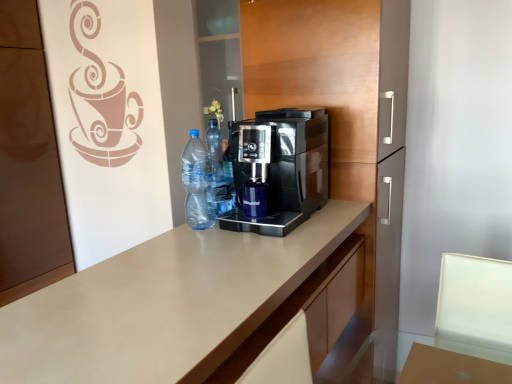
Describe the element at coordinates (165, 304) in the screenshot. I see `beige laminate countertop at center` at that location.

What do you see at coordinates (198, 184) in the screenshot? The width and height of the screenshot is (512, 384). I see `transparent plastic bottle at center, positioned as the second bottle in back-to-front order` at bounding box center [198, 184].

What is the approximate width of black glossy coffee maker at center?

black glossy coffee maker at center is 19.75 inches wide.

Where is `transparent glass table at lower right`? The image size is (512, 384). transparent glass table at lower right is located at coordinates (451, 368).

From a real-world perspective, which bottle is the 1st one above the beige laminate countertop at center? Please provide its 2D coordinates.

[(198, 184)]

Who is taller, transparent plastic bottle at center, positioned as the second bottle in back-to-front order, or beige laminate countertop at center?

With more height is beige laminate countertop at center.

Is transparent plastic bottle at center, which is the first bottle in front-to-back order, not within beige laminate countertop at center?

transparent plastic bottle at center, which is the first bottle in front-to-back order, is positioned outside beige laminate countertop at center.

Which of these two, transparent plastic bottle at center, which is the first bottle in front-to-back order, or beige laminate countertop at center, is wider?

beige laminate countertop at center is wider.

Considering the sizes of black glossy coffee machine at center and transparent plastic bottle at center, positioned as the second bottle in back-to-front order, in the image, is black glossy coffee machine at center taller or shorter than transparent plastic bottle at center, positioned as the second bottle in back-to-front order,?

Considering their sizes, black glossy coffee machine at center has more height than transparent plastic bottle at center, positioned as the second bottle in back-to-front order.

Does point (327, 85) appear closer or farther from the camera than point (190, 219)?

Point (327, 85) appears to be farther away from the viewer than point (190, 219).

This screenshot has height=384, width=512. I want to click on dresser that appears below the transparent plastic bottle at center, positioned as the second bottle in back-to-front order (from a real-world perspective), so click(x=345, y=136).

Is transparent plastic bottle at center, positioned as the second bottle in back-to-front order, completely or partially inside black glossy coffee machine at center?

No, transparent plastic bottle at center, positioned as the second bottle in back-to-front order, is not a part of black glossy coffee machine at center.

Is the position of beige laminate countertop at center less distant than that of transparent plastic bottle at center, positioned as the second bottle in back-to-front order?

Yes, it is.

From the image's perspective, is beige laminate countertop at center above or below transparent plastic bottle at center, positioned as the second bottle in back-to-front order?

beige laminate countertop at center is situated lower than transparent plastic bottle at center, positioned as the second bottle in back-to-front order, in the image.

Is beige laminate countertop at center at the left side of transparent plastic bottle at center, which is the first bottle in front-to-back order?

No, beige laminate countertop at center is not to the left of transparent plastic bottle at center, which is the first bottle in front-to-back order.

Considering the relative sizes of transparent plastic bottle at center, which is the first bottle in front-to-back order, and translucent plastic bottles at center, which is the first bottle in back-to-front order, in the image provided, is transparent plastic bottle at center, which is the first bottle in front-to-back order, bigger than translucent plastic bottles at center, which is the first bottle in back-to-front order,?

Yes, transparent plastic bottle at center, which is the first bottle in front-to-back order, is bigger than translucent plastic bottles at center, which is the first bottle in back-to-front order.

Which is more to the right, transparent plastic bottle at center, positioned as the second bottle in back-to-front order, or translucent plastic bottles at center, which is the first bottle in back-to-front order?

From the viewer's perspective, translucent plastic bottles at center, which is the first bottle in back-to-front order, appears more on the right side.

This screenshot has width=512, height=384. Identify the location of bottle behind the transparent plastic bottle at center, positioned as the second bottle in back-to-front order. (220, 171).

Is translucent plastic bottles at center, which is the first bottle in back-to-front order, at the back of transparent plastic bottle at center, which is the first bottle in front-to-back order?

Yes, translucent plastic bottles at center, which is the first bottle in back-to-front order, is at the back of transparent plastic bottle at center, which is the first bottle in front-to-back order.

Is translucent plastic bottles at center, arranged as the second bottle when viewed from the front, directly adjacent to black glossy coffee machine at center?

No, translucent plastic bottles at center, arranged as the second bottle when viewed from the front, is not next to black glossy coffee machine at center.

Looking at this image, between translucent plastic bottles at center, which is the first bottle in back-to-front order, and black glossy coffee machine at center, which one has larger size?

black glossy coffee machine at center.

Measure the distance between translucent plastic bottles at center, which is the first bottle in back-to-front order, and black glossy coffee machine at center.

23.70 inches.

Is translucent plastic bottles at center, arranged as the second bottle when viewed from the front, at the back of black glossy coffee machine at center?

No, black glossy coffee machine at center is not facing the opposite direction of translucent plastic bottles at center, arranged as the second bottle when viewed from the front.

Measure the distance between black glossy coffee machine at center and translucent plastic bottles at center, arranged as the second bottle when viewed from the front.

black glossy coffee machine at center and translucent plastic bottles at center, arranged as the second bottle when viewed from the front, are 23.70 inches apart.

From a real-world perspective, between black glossy coffee machine at center and translucent plastic bottles at center, which is the first bottle in back-to-front order, who is vertically lower?

In real-world perspective, black glossy coffee machine at center is lower.

Does black glossy coffee machine at center have a smaller size compared to black glossy coffee maker at center?

Incorrect, black glossy coffee machine at center is not smaller in size than black glossy coffee maker at center.

Can you confirm if black glossy coffee machine at center is positioned to the right of black glossy coffee maker at center?

Correct, you'll find black glossy coffee machine at center to the right of black glossy coffee maker at center.

Which is in front, point (395, 52) or point (249, 230)?

The point (249, 230) is in front.

From the image's perspective, is black glossy coffee machine at center on black glossy coffee maker at center?

Incorrect, from the image's perspective, black glossy coffee machine at center is lower than black glossy coffee maker at center.

At what (x,y) coordinates should I click in order to perform the action: click on countertop below the transparent plastic bottle at center, which is the first bottle in front-to-back order (from the image's perspective). Please return your answer as a coordinate pair (x, y). Looking at the image, I should click on (165, 304).

Image resolution: width=512 pixels, height=384 pixels. I want to click on bottle that is the 2nd one when counting leftward from the black glossy coffee machine at center, so click(198, 184).

Looking at the image, which one is located closer to transparent plastic bottle at center, which is the first bottle in front-to-back order, black glossy coffee maker at center or transparent glass table at lower right?

Based on the image, black glossy coffee maker at center appears to be nearer to transparent plastic bottle at center, which is the first bottle in front-to-back order.

From the image, which object appears to be farther from transparent plastic bottle at center, positioned as the second bottle in back-to-front order, black glossy coffee maker at center or black glossy coffee machine at center?

black glossy coffee machine at center is further to transparent plastic bottle at center, positioned as the second bottle in back-to-front order.

Looking at the image, which one is located closer to transparent plastic bottle at center, which is the first bottle in front-to-back order, beige laminate countertop at center or black glossy coffee machine at center?

The object closer to transparent plastic bottle at center, which is the first bottle in front-to-back order, is beige laminate countertop at center.

Looking at this image, considering their positions, is transparent plastic bottle at center, positioned as the second bottle in back-to-front order, positioned further to black glossy coffee machine at center than beige laminate countertop at center?

Based on the image, beige laminate countertop at center appears to be further to black glossy coffee machine at center.

Based on their spatial positions, is transparent plastic bottle at center, which is the first bottle in front-to-back order, or beige laminate countertop at center closer to black glossy coffee maker at center?

transparent plastic bottle at center, which is the first bottle in front-to-back order.

Consider the image. Estimate the real-world distances between objects in this image. Which object is closer to black glossy coffee maker at center, transparent glass table at lower right or transparent plastic bottle at center, which is the first bottle in front-to-back order?

The object closer to black glossy coffee maker at center is transparent plastic bottle at center, which is the first bottle in front-to-back order.

Based on their spatial positions, is black glossy coffee maker at center or beige laminate countertop at center further from transparent plastic bottle at center, positioned as the second bottle in back-to-front order?

beige laminate countertop at center lies further to transparent plastic bottle at center, positioned as the second bottle in back-to-front order, than the other object.

Estimate the real-world distances between objects in this image. Which object is further from beige laminate countertop at center, black glossy coffee maker at center or translucent plastic bottles at center, arranged as the second bottle when viewed from the front?

translucent plastic bottles at center, arranged as the second bottle when viewed from the front, is positioned further to the anchor beige laminate countertop at center.

The height and width of the screenshot is (384, 512). What are the coordinates of `countertop between transparent plastic bottle at center, which is the first bottle in front-to-back order, and transparent glass table at lower right, in the horizontal direction` in the screenshot? It's located at (165, 304).

Find the location of a particular element. The height and width of the screenshot is (384, 512). dresser between beige laminate countertop at center and translucent plastic bottles at center, arranged as the second bottle when viewed from the front, along the z-axis is located at coordinates (345, 136).

The height and width of the screenshot is (384, 512). Find the location of `bottle between black glossy coffee maker at center and translucent plastic bottles at center, which is the first bottle in back-to-front order, in the front-back direction`. bottle between black glossy coffee maker at center and translucent plastic bottles at center, which is the first bottle in back-to-front order, in the front-back direction is located at coordinates (198, 184).

I want to click on bottle between beige laminate countertop at center and translucent plastic bottles at center, arranged as the second bottle when viewed from the front, in the front-back direction, so click(x=198, y=184).